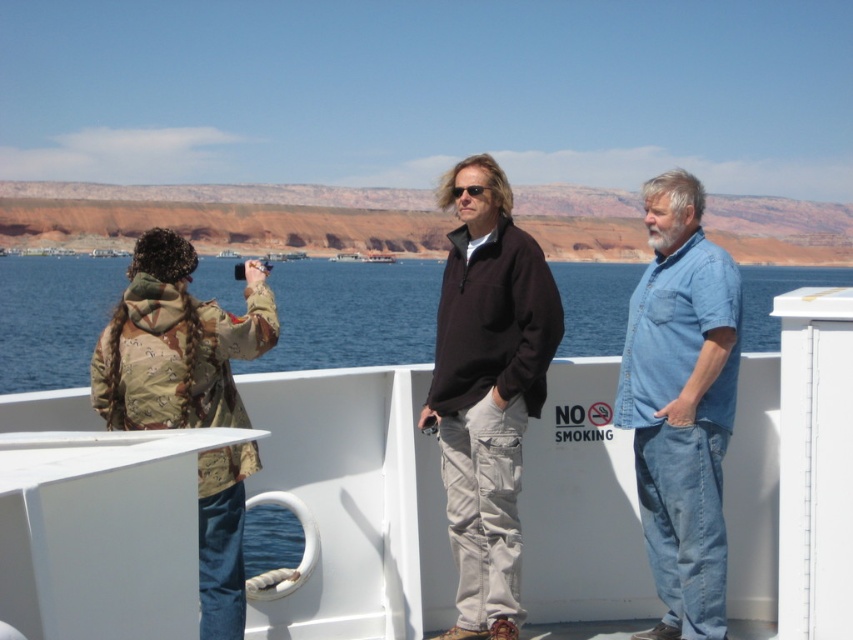
You are a photographer on the boat deck. You need to place a small tripod between the dark brown fleece at center and the camouflage jacket at left. Can you fit it there?

The dark brown fleece at center is located above the camouflage jacket at left, so there is vertical space between them. However, the horizontal distance isn not specified, so it depends on the tripod size and positioning.

In the scene shown: You are standing on the boat deck and want to take a photo of the blue water at center. Where should you point your camera?

You should point your camera towards the center of the boat deck where the blue water at center is located at coordinates approximately 0.492 on the x axis and 0.413 on the y axis.

Looking at this image, you are standing on the boat deck and want to hand a souvenir to the person wearing the camouflage jacket at left. Which person do you need to walk around to reach them without going past the dark brown fleece at center?

You need to walk around the dark brown fleece at center because it is closer to you than the camouflage jacket at left, so you must go around it to reach the camouflage jacket at left without passing beyond it.